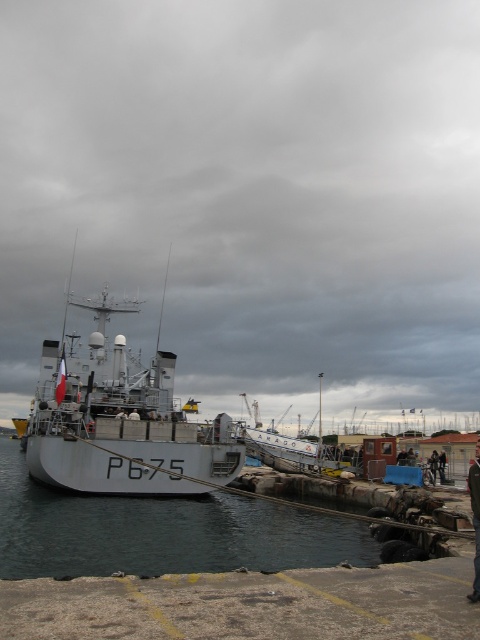
Question: Which of the following is the closest to the observer?

Choices:
 (A) (471, 600)
 (B) (51, 524)
 (C) (72, 356)
 (D) (57, 152)

Answer: (A)

Question: Does white matte ship at center appear on the right side of dark blue uniform at center?

Choices:
 (A) yes
 (B) no

Answer: (B)

Question: Based on their relative distances, which object is nearer to the white matte ship at center?

Choices:
 (A) dark blue uniform at center
 (B) metallic gray ship at center

Answer: (A)

Question: Can you confirm if metallic gray ship at center is positioned to the right of white matte ship at center?

Choices:
 (A) yes
 (B) no

Answer: (A)

Question: Is gray matte water at center to the right of white matte ship at center from the viewer's perspective?

Choices:
 (A) yes
 (B) no

Answer: (A)

Question: Which point is closer to the camera?

Choices:
 (A) gray matte water at center
 (B) metallic gray ship at center
 (C) dark blue uniform at center

Answer: (C)